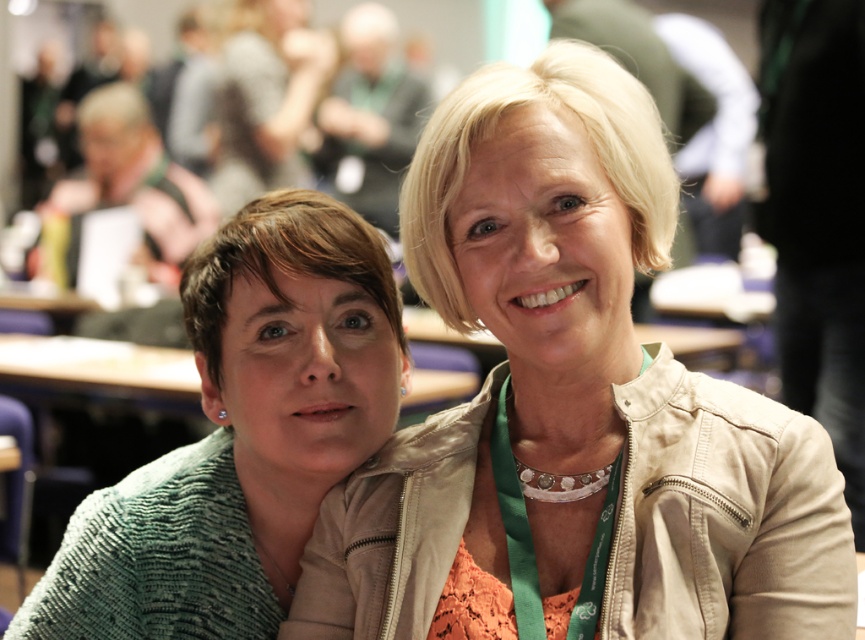
Who is lower down, beige leather jacket at upper center or green knitted sweater at left?

green knitted sweater at left

Is beige leather jacket at upper center to the right of green knitted sweater at left from the viewer's perspective?

Indeed, beige leather jacket at upper center is positioned on the right side of green knitted sweater at left.

The width and height of the screenshot is (865, 640). In order to click on beige leather jacket at upper center in this screenshot , I will do `click(572, 406)`.